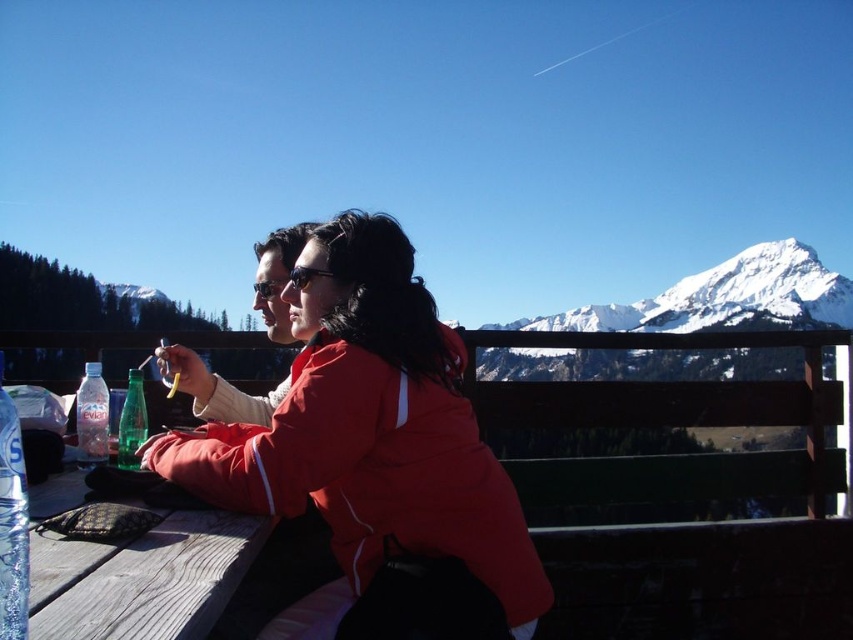
The image size is (853, 640). What do you see at coordinates (143, 579) in the screenshot?
I see `wooden table at lower left` at bounding box center [143, 579].

Can you confirm if wooden table at lower left is bigger than clear plastic bottle at table left?

Correct, wooden table at lower left is larger in size than clear plastic bottle at table left.

The height and width of the screenshot is (640, 853). What do you see at coordinates (143, 579) in the screenshot? I see `wooden table at lower left` at bounding box center [143, 579].

Find the location of a particular element. wooden table at lower left is located at coordinates (143, 579).

Is matte red jacket at center thinner than clear plastic bottle at lower left?

No.

Who is more distant from viewer, (183, 468) or (1, 436)?

Positioned behind is point (183, 468).

What do you see at coordinates (376, 452) in the screenshot? Image resolution: width=853 pixels, height=640 pixels. I see `matte red jacket at center` at bounding box center [376, 452].

Locate an element on the screen. matte red jacket at center is located at coordinates (376, 452).

Is clear plastic bottle at lower left shorter than clear plastic bottle at table left?

No.

Does clear plastic bottle at lower left have a smaller size compared to clear plastic bottle at table left?

No.

Who is more distant from viewer, (x=22, y=504) or (x=103, y=417)?

The point (x=103, y=417) is more distant.

The width and height of the screenshot is (853, 640). Find the location of `clear plastic bottle at lower left`. clear plastic bottle at lower left is located at coordinates pyautogui.click(x=12, y=522).